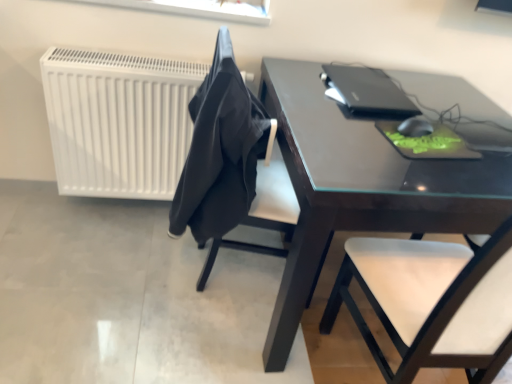
Where is `vacant region below white matte radiator at left (from a real-world perspective)`? The width and height of the screenshot is (512, 384). vacant region below white matte radiator at left (from a real-world perspective) is located at coordinates (122, 205).